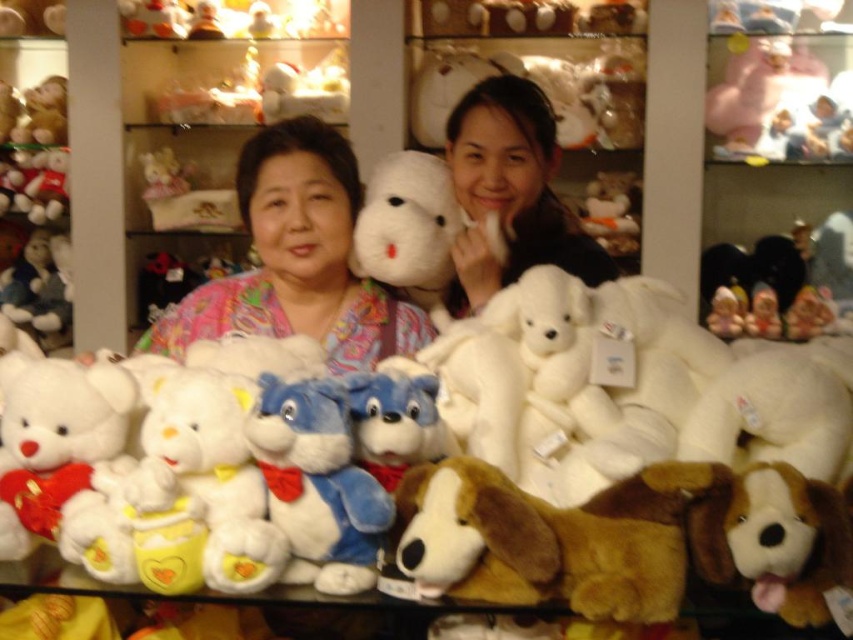
You are a customer in a toy store looking at the display of plush toys. You see the fluffy white teddy bear at upper left and the white plush bear at upper center. Which bear is positioned lower in the display?

The fluffy white teddy bear at upper left is located below the white plush bear at upper center, so the fluffy white teddy bear at upper left is positioned lower in the display.

You are a customer in the store looking at the display. You want to buy the taller teddy bear between the matte white teddy bear at upper center and the white plush bear at upper center. Which one should you choose?

The matte white teddy bear at upper center is taller than the white plush bear at upper center, so you should choose the matte white teddy bear at upper center.

You are a customer in the store and want to know if the two points you see in the image are aligned horizontally. Can you determine if point (x=167, y=186) and point (x=210, y=8) are on the same horizontal level?

The two points are not exactly on the same horizontal level. Point (x=167, y=186) is slightly below point (x=210, y=8) since its y coordinate is 0.197 versus 0.247.